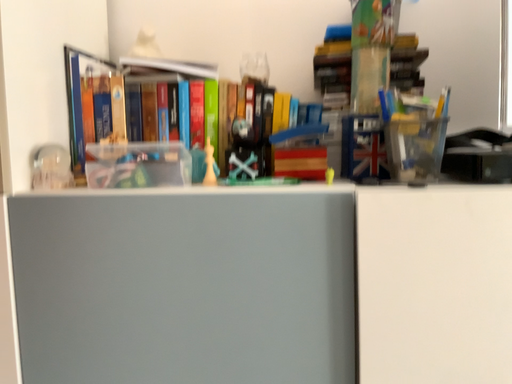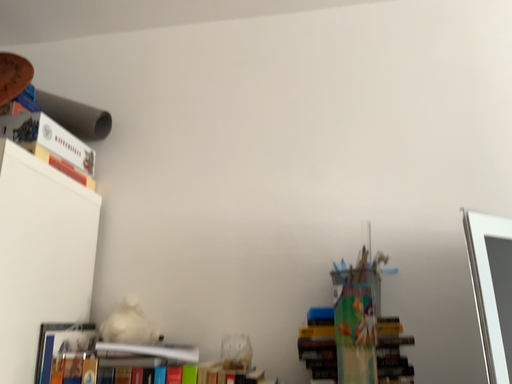
Question: Which way did the camera rotate in the video?

Choices:
 (A) rotated upward
 (B) rotated downward

Answer: (A)